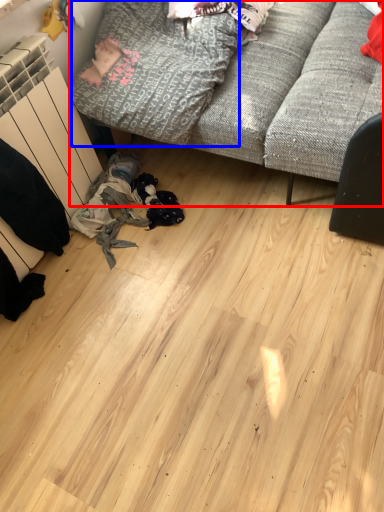
Question: Which of the following is the closest to the observer, studio couch (highlighted by a red box) or clothing (highlighted by a blue box)?

Choices:
 (A) studio couch
 (B) clothing

Answer: (A)